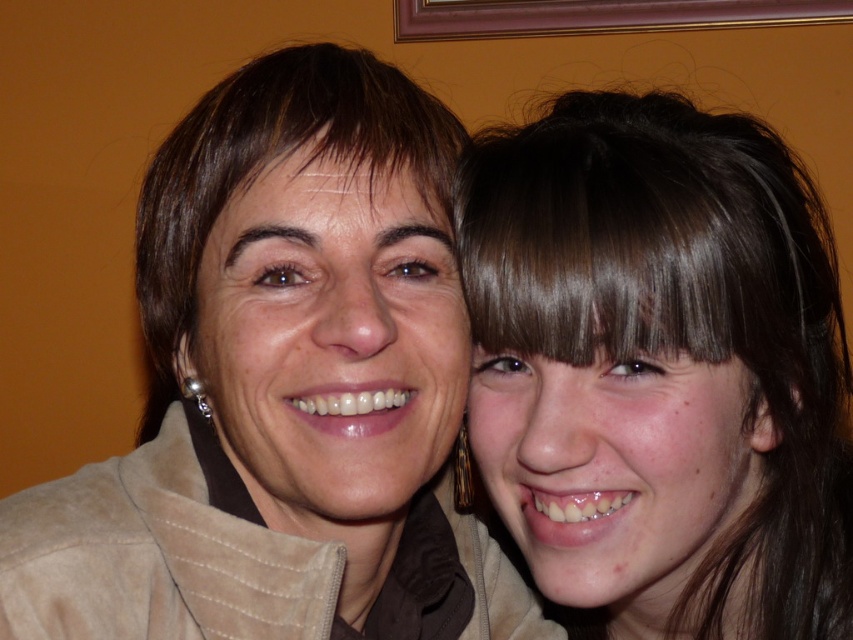
Who is more distant from viewer, (169, 292) or (573, 227)?

The point (169, 292) is behind.

Can you confirm if suede jacket at center is bigger than brown hair at right?

Yes.

Who is more forward, (x=171, y=300) or (x=666, y=282)?

Positioned in front is point (x=666, y=282).

Identify the location of suede jacket at center. The height and width of the screenshot is (640, 853). (283, 388).